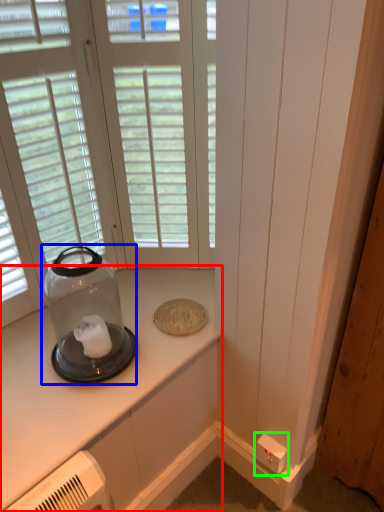
Question: Which is nearer to the countertop (highlighted by a red box)? glass vase (highlighted by a blue box) or electric outlet (highlighted by a green box).

Choices:
 (A) glass vase
 (B) electric outlet

Answer: (A)